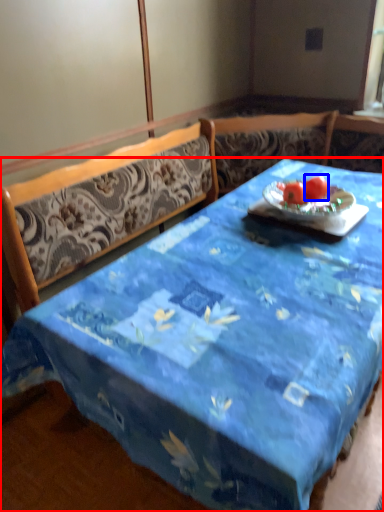
Question: Which point is further to the camera, desk (highlighted by a red box) or tomato (highlighted by a blue box)?

Choices:
 (A) desk
 (B) tomato

Answer: (B)